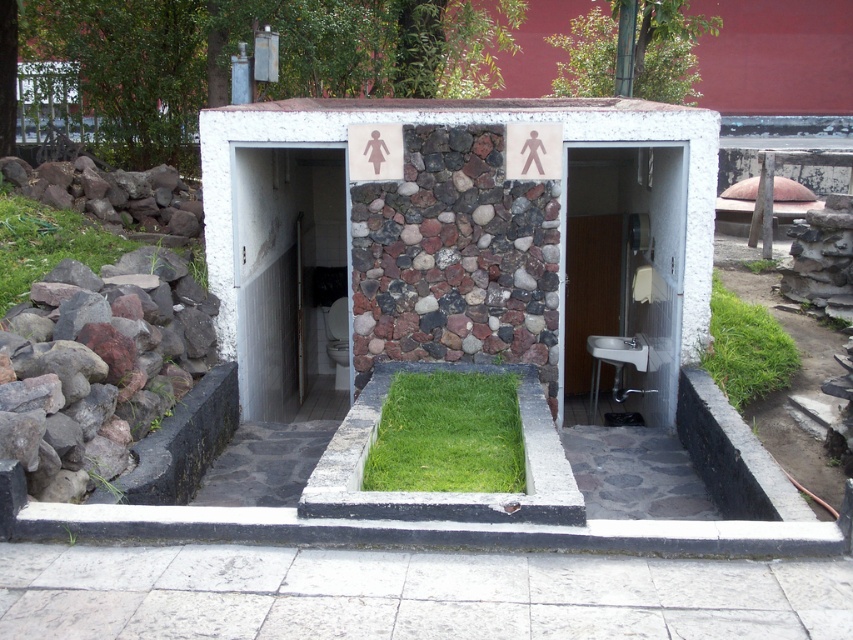
Between point (436, 284) and point (595, 282), which one is positioned behind?

Point (595, 282)

Can you confirm if stony mosaic wall at center is positioned above white ceramic sink at center?

No.

Does point (434, 314) come farther from viewer compared to point (675, 248)?

Yes, point (434, 314) is farther from viewer.

This screenshot has width=853, height=640. In order to click on stony mosaic wall at center in this screenshot , I will do `click(454, 256)`.

Does white ceramic sink at center appear under green grass at lower left?

Correct, white ceramic sink at center is located below green grass at lower left.

Can you confirm if white ceramic sink at center is smaller than green grass at lower left?

Actually, white ceramic sink at center might be larger than green grass at lower left.

Which is behind, point (596, 221) or point (112, 236)?

The point (596, 221) is behind.

The width and height of the screenshot is (853, 640). In order to click on white ceramic sink at center in this screenshot , I will do `click(625, 264)`.

Who is more distant from viewer, (172, 381) or (195, 225)?

Positioned behind is point (195, 225).

Who is positioned more to the left, gray rock at lower left or gray rough rocks at left?

From the viewer's perspective, gray rough rocks at left appears more on the left side.

Who is more distant from viewer, (33, 467) or (103, 195)?

Answer: Point (103, 195)

Find the location of a particular element. The image size is (853, 640). gray rock at lower left is located at coordinates (102, 374).